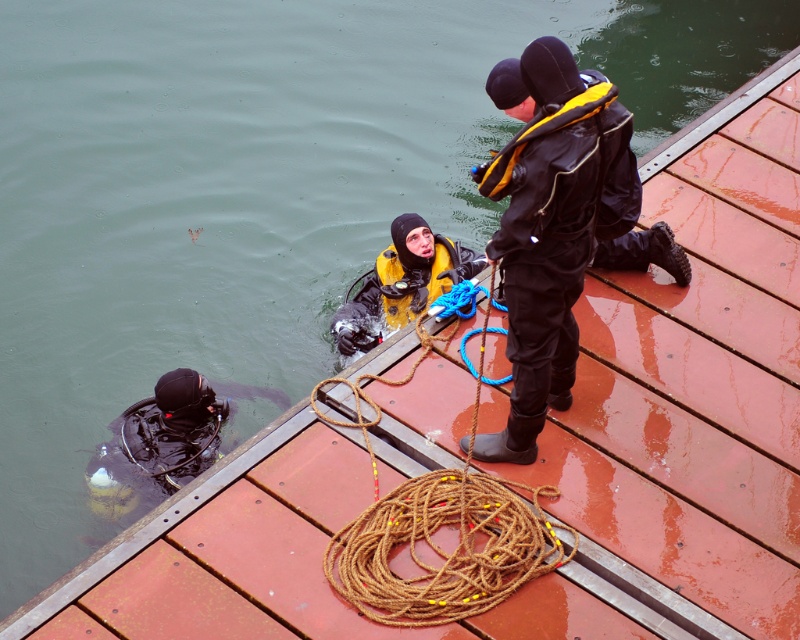
Question: Which point is closer to the camera?

Choices:
 (A) (176, 378)
 (B) (582, 198)

Answer: (B)

Question: Can you confirm if brown rough rope at center is bigger than yellow matte diving suit at center?

Choices:
 (A) yes
 (B) no

Answer: (A)

Question: Can you confirm if brown rough rope at center is smaller than black matte diving suit at lower left?

Choices:
 (A) yes
 (B) no

Answer: (B)

Question: Among these points, which one is farthest from the camera?

Choices:
 (A) (624, 161)
 (B) (132, 413)
 (C) (441, 259)
 (D) (470, 545)

Answer: (C)

Question: Can you confirm if black matte wetsuit at upper right is positioned below brown rough rope at center?

Choices:
 (A) yes
 (B) no

Answer: (B)

Question: Which of the following is the farthest from the observer?

Choices:
 (A) (182, 444)
 (B) (377, 512)

Answer: (A)